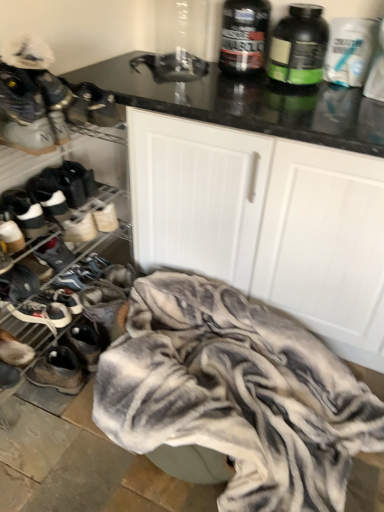
Question: Is dark gray suede sneaker at lower left, acting as the eighth footwear starting from the top, with white textured blanket at lower center?

Choices:
 (A) yes
 (B) no

Answer: (B)

Question: Does dark gray suede sneaker at lower left, placed as the 2th footwear when sorted from bottom to top, appear on the right side of white textured blanket at lower center?

Choices:
 (A) yes
 (B) no

Answer: (B)

Question: Would you say dark gray suede sneaker at lower left, acting as the eighth footwear starting from the top, contains white textured blanket at lower center?

Choices:
 (A) no
 (B) yes

Answer: (A)

Question: Considering the relative sizes of dark gray suede sneaker at lower left, acting as the eighth footwear starting from the top, and white textured blanket at lower center in the image provided, is dark gray suede sneaker at lower left, acting as the eighth footwear starting from the top, smaller than white textured blanket at lower center?

Choices:
 (A) yes
 (B) no

Answer: (A)

Question: Could you tell me if dark gray suede sneaker at lower left, placed as the 2th footwear when sorted from bottom to top, is turned towards white textured blanket at lower center?

Choices:
 (A) no
 (B) yes

Answer: (B)

Question: From the image's perspective, is white leather sneakers at left, placed as the fourth footwear when sorted from bottom to top, located above or below white matte cabinet at center?

Choices:
 (A) below
 (B) above

Answer: (A)

Question: In terms of height, does white leather sneakers at left, which is the 6th footwear in top-to-bottom order, look taller or shorter compared to white matte cabinet at center?

Choices:
 (A) tall
 (B) short

Answer: (B)

Question: Is white leather sneakers at left, placed as the fourth footwear when sorted from bottom to top, inside the boundaries of white matte cabinet at center, or outside?

Choices:
 (A) outside
 (B) inside

Answer: (A)

Question: Looking at their shapes, would you say white leather sneakers at left, placed as the fourth footwear when sorted from bottom to top, is wider or thinner than white matte cabinet at center?

Choices:
 (A) thin
 (B) wide

Answer: (A)

Question: Considering the positions of suede brown shoe at lower left, placed as the 7th footwear when sorted from top to bottom, and white suede sneaker at left, acting as the 7th footwear starting from the bottom, in the image, is suede brown shoe at lower left, placed as the 7th footwear when sorted from top to bottom, wider or thinner than white suede sneaker at left, acting as the 7th footwear starting from the bottom,?

Choices:
 (A) wide
 (B) thin

Answer: (A)

Question: Is suede brown shoe at lower left, placed as the 7th footwear when sorted from top to bottom, inside the boundaries of white suede sneaker at left, acting as the 7th footwear starting from the bottom, or outside?

Choices:
 (A) inside
 (B) outside

Answer: (B)

Question: Is suede brown shoe at lower left, placed as the 7th footwear when sorted from top to bottom, taller or shorter than white suede sneaker at left, acting as the 7th footwear starting from the bottom?

Choices:
 (A) tall
 (B) short

Answer: (B)

Question: From a real-world perspective, is suede brown shoe at lower left, which is the third footwear from bottom to top, above or below white suede sneaker at left, arranged as the third footwear when viewed from the top?

Choices:
 (A) below
 (B) above

Answer: (A)

Question: From a real-world perspective, is white suede sneakers at left, the second footwear when ordered from top to bottom, above or below dark gray suede sneaker at lower left, acting as the eighth footwear starting from the top?

Choices:
 (A) below
 (B) above

Answer: (B)

Question: Considering the relative positions of white suede sneakers at left, which is the 8th footwear from bottom to top, and dark gray suede sneaker at lower left, placed as the 2th footwear when sorted from bottom to top, in the image provided, is white suede sneakers at left, which is the 8th footwear from bottom to top, to the left or to the right of dark gray suede sneaker at lower left, placed as the 2th footwear when sorted from bottom to top,?

Choices:
 (A) right
 (B) left

Answer: (A)